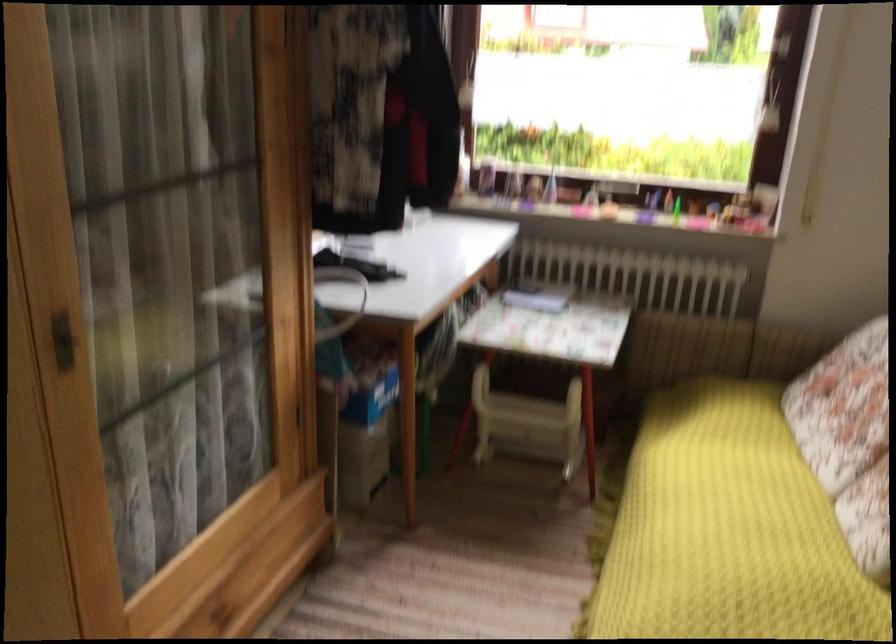
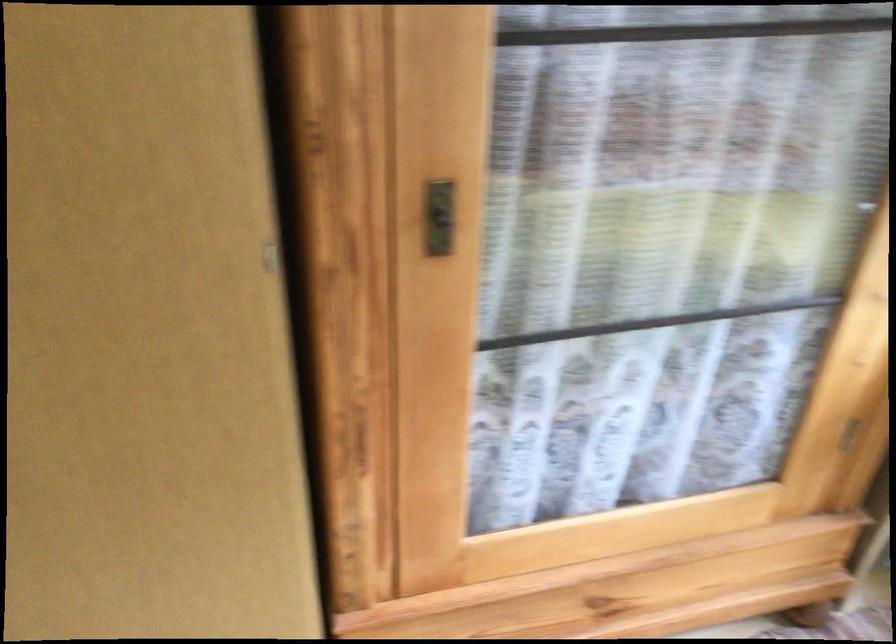
The images are taken continuously from a first-person perspective. In which direction is your viewpoint rotating?

The camera's rotation is toward left-down.